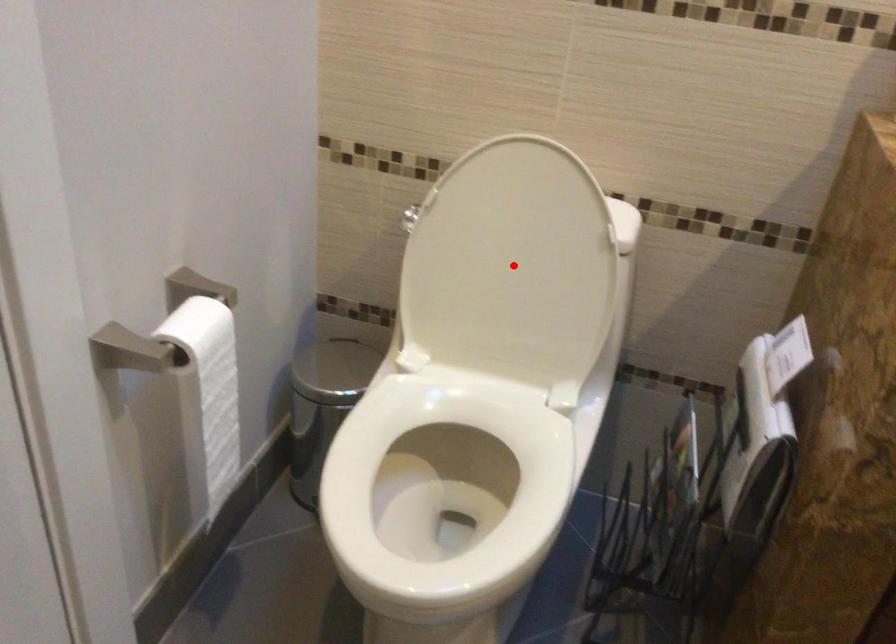
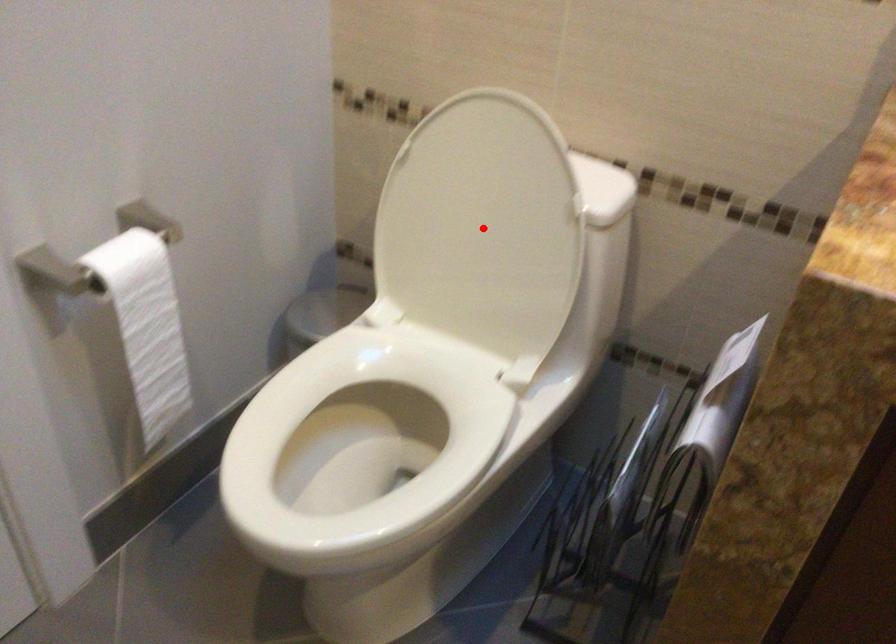
I am providing you with two images of the same scene from different viewpoints. A red point is marked on the first image and another point is marked on the second image. Are the points marked in image1 and image2 representing the same 3D position?

Yes